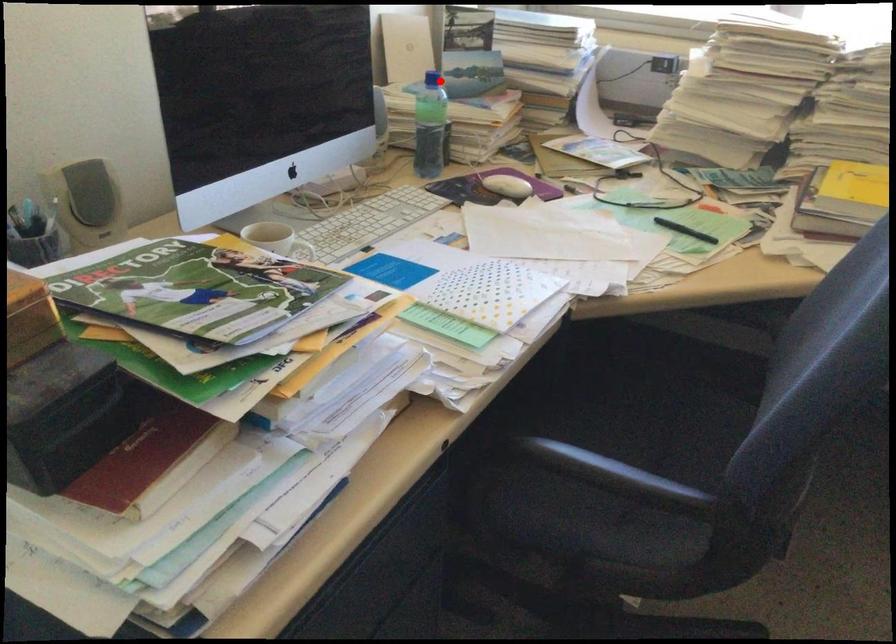
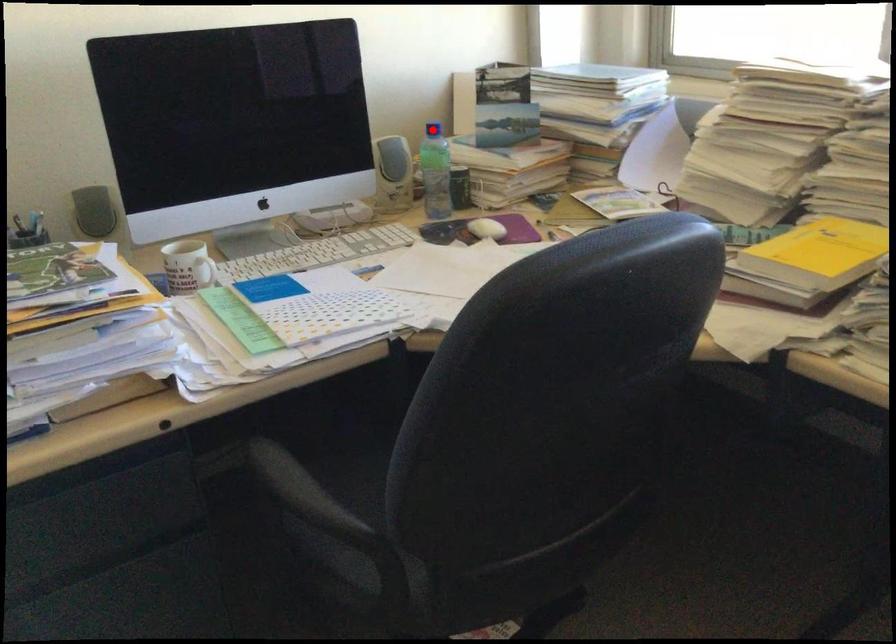
I am providing you with two images of the same scene from different viewpoints. A red point is marked on the first image and another point is marked on the second image. Do the highlighted points in image1 and image2 indicate the same real-world spot?

Yes